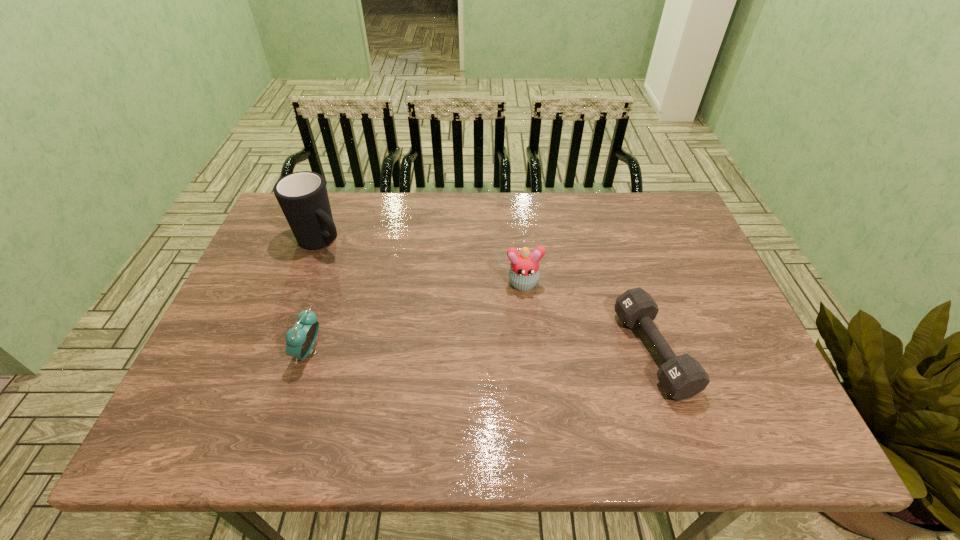
Where is `free area in between the rightmost object and the third object from left to right`? This screenshot has height=540, width=960. free area in between the rightmost object and the third object from left to right is located at coordinates (588, 318).

In order to click on vacant area that lies between the alarm clock and the mug in this screenshot , I will do [316, 297].

What are the coordinates of `free space between the third object from left to right and the rightmost object` in the screenshot? It's located at (588, 318).

The height and width of the screenshot is (540, 960). In order to click on unoccupied position between the alarm clock and the cupcake in this screenshot , I will do `click(417, 318)`.

Find the location of a particular element. free space between the third nearest object and the alarm clock is located at coordinates (417, 318).

You are a GUI agent. You are given a task and a screenshot of the screen. Output one action in this format:
    pyautogui.click(x=<x>, y=<y>)
    Task: Click on the free spot between the dumbbell and the farthest object
    The width and height of the screenshot is (960, 540).
    Given the screenshot: What is the action you would take?
    click(x=487, y=296)

Find the location of a particular element. The image size is (960, 540). free spot between the rightmost object and the tallest object is located at coordinates (487, 296).

Identify which object is the second closest to the shortest object. Please provide its 2D coordinates. Your answer should be formatted as a tuple, i.e. [(x, y)], where the tuple contains the x and y coordinates of a point satisfying the conditions above.

[(300, 339)]

This screenshot has width=960, height=540. Identify the location of object that stands as the third closest to the farthest object. (682, 377).

Where is `vacant point that satisfies the following two spatial constraints: 1. on the front side of the cupcake; 2. on the left side of the farthest object`? vacant point that satisfies the following two spatial constraints: 1. on the front side of the cupcake; 2. on the left side of the farthest object is located at coordinates (306, 283).